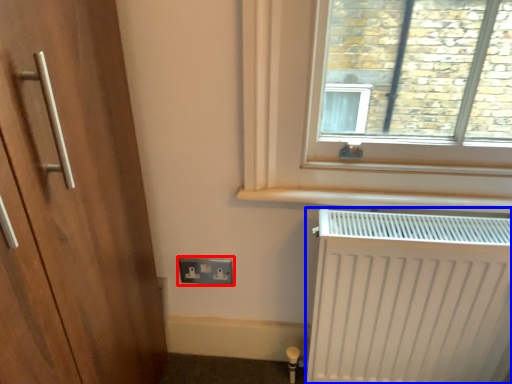
Question: Which object is further to the camera taking this photo, electric outlet (highlighted by a red box) or radiator (highlighted by a blue box)?

Choices:
 (A) electric outlet
 (B) radiator

Answer: (A)